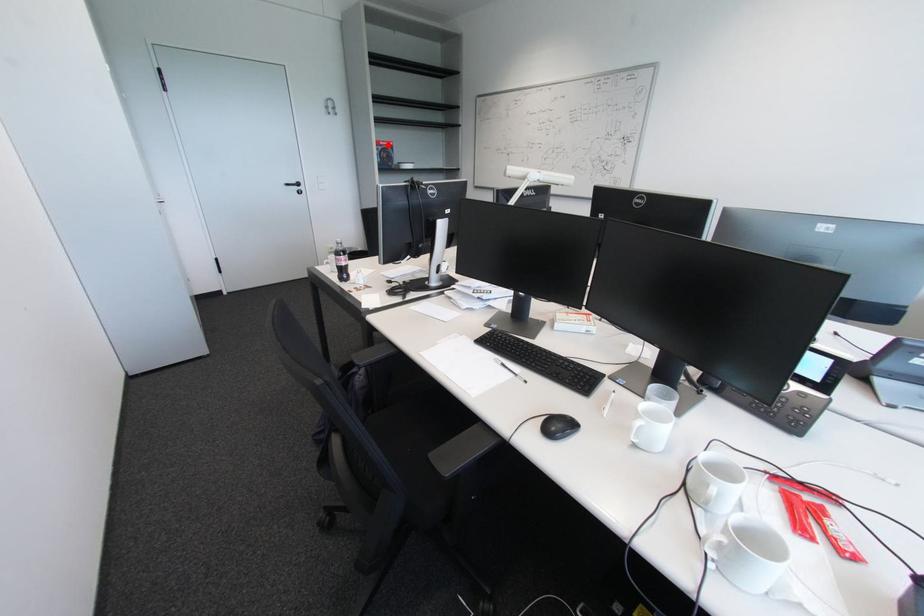
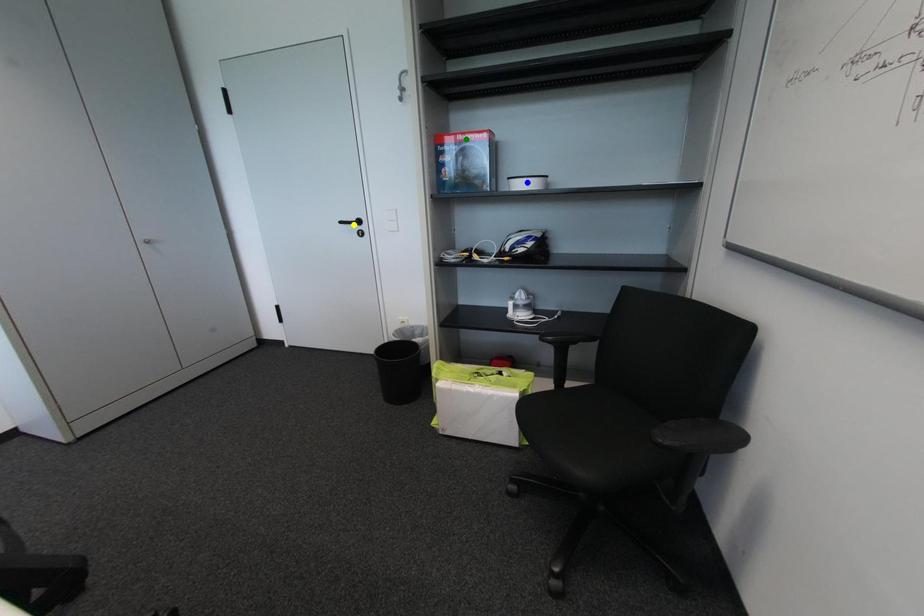
Question: I am providing you with two images of the same scene from different viewpoints. A red point is marked on the first image. You are given multiple points on the second image. Which point in image 2 represents the same 3d spot as the red point in image 1?

Choices:
 (A) blue point
 (B) yellow point
 (C) green point

Answer: (C)